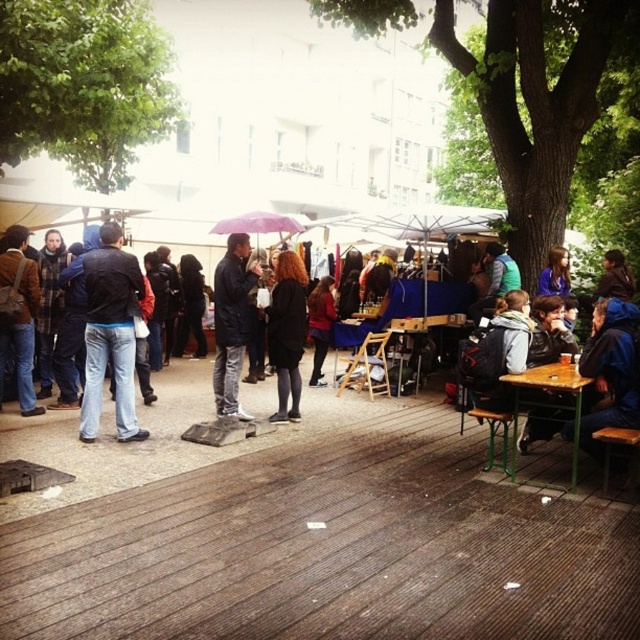
The width and height of the screenshot is (640, 640). Describe the element at coordinates (257, 224) in the screenshot. I see `purple fabric umbrella at center` at that location.

Does point (256, 212) come closer to viewer compared to point (563, 280)?

No.

Locate an element on the screen. The height and width of the screenshot is (640, 640). purple fabric umbrella at center is located at coordinates (257, 224).

Is jeans at left positioned before matte black jacket at left?

Yes, jeans at left is closer to the viewer.

Can you confirm if jeans at left is positioned to the right of matte black jacket at left?

Correct, you'll find jeans at left to the right of matte black jacket at left.

Does point (109, 320) lie behind point (24, 228)?

No, (109, 320) is in front of (24, 228).

The height and width of the screenshot is (640, 640). I want to click on jeans at left, so click(109, 332).

Does point (33, 356) lie in front of point (557, 273)?

Yes, point (33, 356) is closer to viewer.

From the picture: Does matte black jacket at left have a larger size compared to blue fabric shirt at center?

Indeed, matte black jacket at left has a larger size compared to blue fabric shirt at center.

Who is more forward, (19, 289) or (556, 269)?

Positioned in front is point (19, 289).

Locate an element on the screen. Image resolution: width=640 pixels, height=640 pixels. matte black jacket at left is located at coordinates (19, 316).